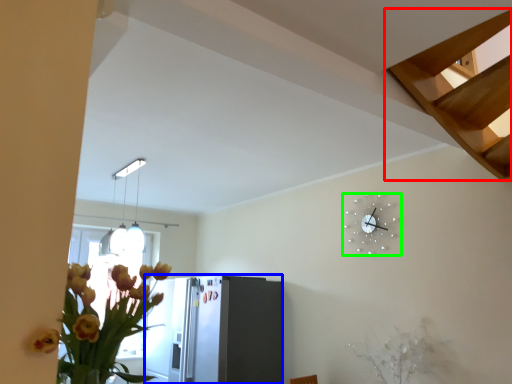
Question: Based on their relative distances, which object is farther from stairs (highlighted by a red box)? Choose from appliance (highlighted by a blue box) and wall clock (highlighted by a green box).

Choices:
 (A) appliance
 (B) wall clock

Answer: (A)